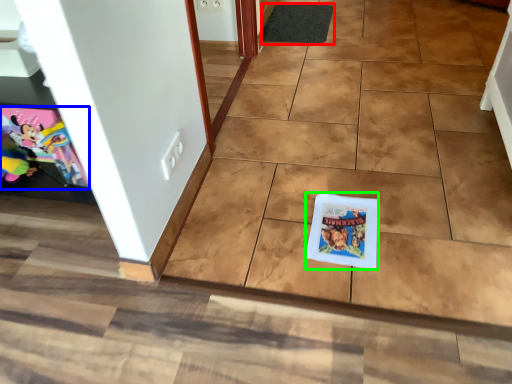
Question: Which object is positioned farthest from doormat (highlighted by a red box)? Select from comic book (highlighted by a blue box) and comic book (highlighted by a green box).

Choices:
 (A) comic book
 (B) comic book

Answer: (A)